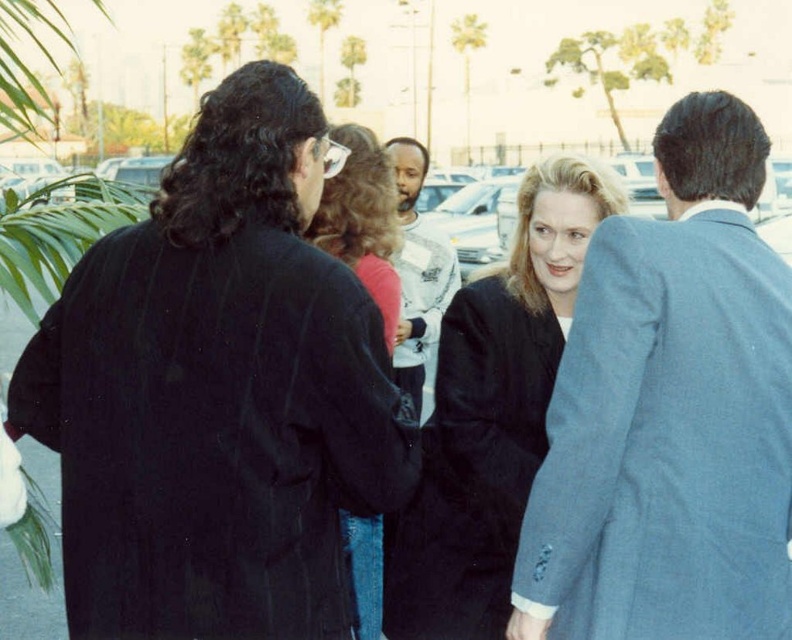
Question: Considering the real-world distances, which object is closest to the blue textured suit at right?

Choices:
 (A) matte black coat at center
 (B) matte black jacket at center

Answer: (A)

Question: Based on their relative distances, which object is nearer to the matte black coat at center?

Choices:
 (A) matte black jacket at center
 (B) black pinstripe suit at left
 (C) white cotton shirt at center

Answer: (A)

Question: Which of the following is the closest to the observer?

Choices:
 (A) (347, 342)
 (B) (516, 465)

Answer: (A)

Question: Does matte black coat at center appear under matte black jacket at center?

Choices:
 (A) no
 (B) yes

Answer: (B)

Question: Does blue textured suit at right lie in front of white cotton shirt at center?

Choices:
 (A) yes
 (B) no

Answer: (A)

Question: In this image, where is black pinstripe suit at left located relative to blue textured suit at right?

Choices:
 (A) left
 (B) right

Answer: (A)